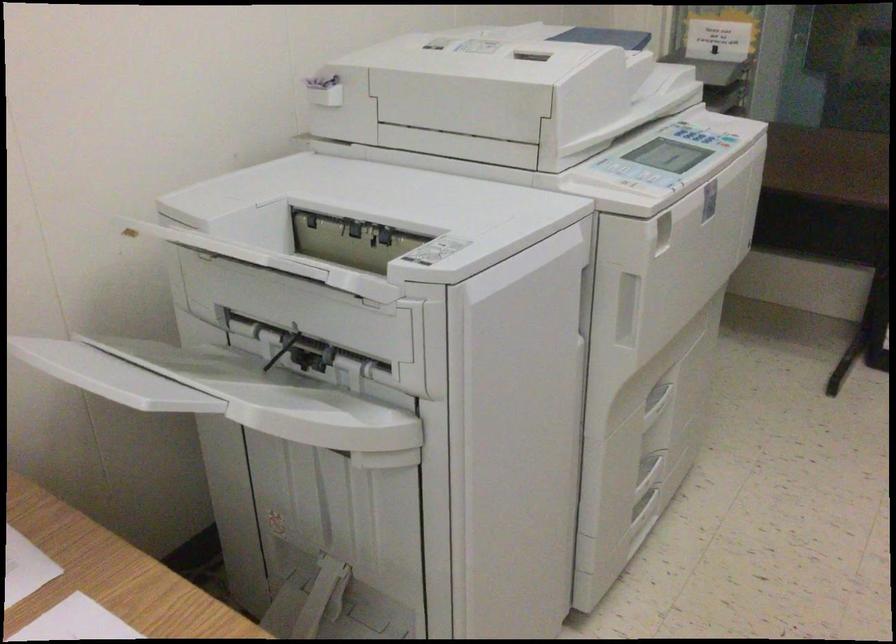
You are a GUI agent. You are given a task and a screenshot of the screen. Output one action in this format:
    pyautogui.click(x=<x>, y=<y>)
    Task: Click on the paper output tray
    
    Given the screenshot: What is the action you would take?
    pyautogui.click(x=313, y=413)